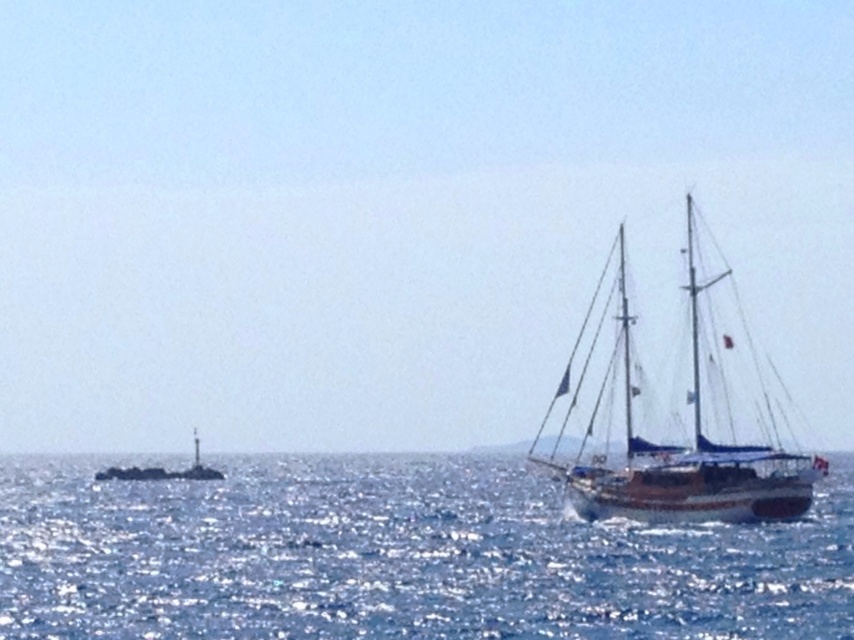
Does blue water at lower right have a larger size compared to white plastic buoy at left?

Correct, blue water at lower right is larger in size than white plastic buoy at left.

Is blue water at lower right to the left of white plastic buoy at left from the viewer's perspective?

No, blue water at lower right is not to the left of white plastic buoy at left.

Identify the location of blue water at lower right. This screenshot has width=854, height=640. (398, 556).

Find the location of a particular element. blue water at lower right is located at coordinates (398, 556).

The image size is (854, 640). What are the coordinates of `blue water at lower right` in the screenshot? It's located at (398, 556).

Is point (502, 512) more distant than point (823, 467)?

Yes, point (502, 512) is behind point (823, 467).

Where is `blue water at lower right`? This screenshot has width=854, height=640. blue water at lower right is located at coordinates (398, 556).

What do you see at coordinates (671, 444) in the screenshot?
I see `wooden sailboat at right` at bounding box center [671, 444].

Is point (591, 422) positioned before point (192, 468)?

Yes, it is in front of point (192, 468).

Identify the location of wooden sailboat at right. The width and height of the screenshot is (854, 640). (671, 444).